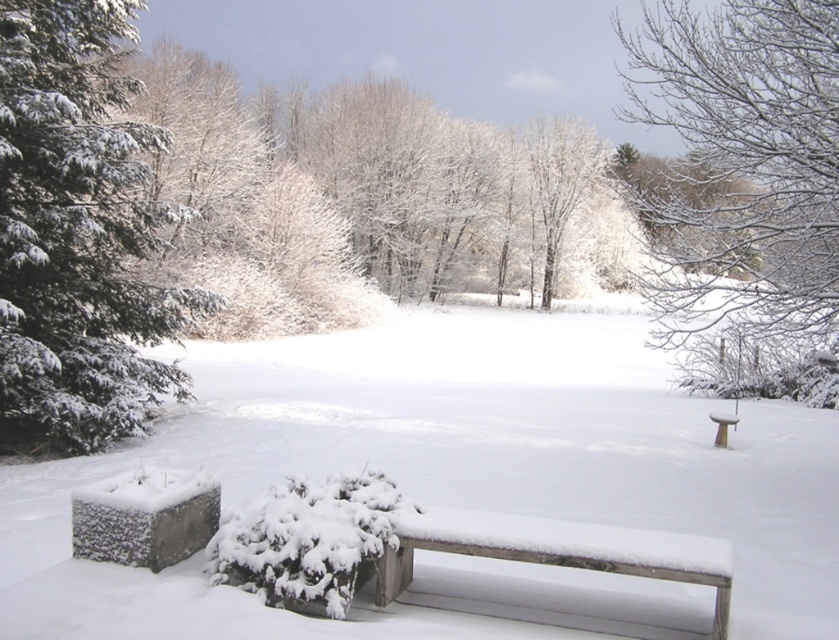
Between white matte snow at center and snow-covered evergreen at left, which one has more height?

snow-covered evergreen at left is taller.

Can you confirm if white matte snow at center is positioned to the right of snow-covered evergreen at left?

Correct, you'll find white matte snow at center to the right of snow-covered evergreen at left.

Where is `white matte snow at center`? white matte snow at center is located at coordinates pos(447,467).

Where is `white matte snow at center`? white matte snow at center is located at coordinates [447, 467].

Is snow-covered wood bench at lower center to the left of white wooden bench at center from the viewer's perspective?

Correct, you'll find snow-covered wood bench at lower center to the left of white wooden bench at center.

Does snow-covered wood bench at lower center appear over white wooden bench at center?

Correct, snow-covered wood bench at lower center is located above white wooden bench at center.

Locate an element on the screen. Image resolution: width=839 pixels, height=640 pixels. snow-covered wood bench at lower center is located at coordinates (558, 550).

How distant is white matte snow at center from snow-covered wood bench at lower center?

white matte snow at center and snow-covered wood bench at lower center are 18.68 feet apart.

Can you confirm if white matte snow at center is positioned to the right of snow-covered wood bench at lower center?

Indeed, white matte snow at center is positioned on the right side of snow-covered wood bench at lower center.

Between point (331, 461) and point (577, 536), which one is positioned behind?

The point (331, 461) is behind.

At what (x,y) coordinates should I click in order to perform the action: click on white matte snow at center. Please return your answer as a coordinate pair (x, y). The width and height of the screenshot is (839, 640). Looking at the image, I should click on (447, 467).